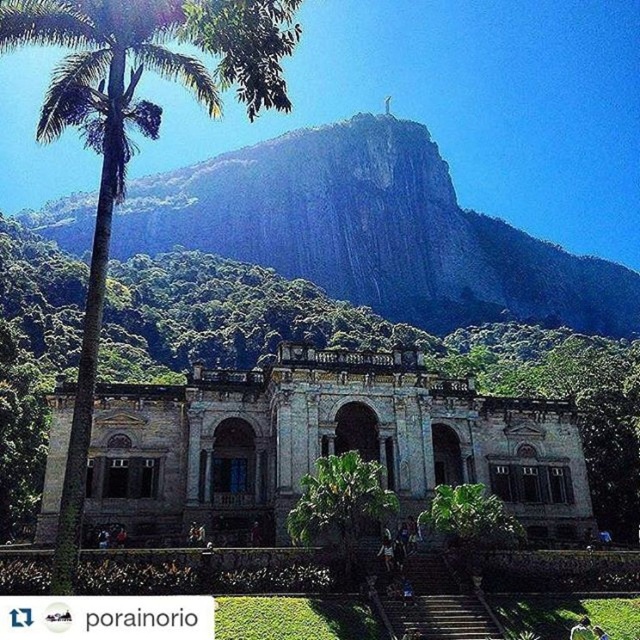
Who is taller, weathered stone palace at center or black fabric person at center?

weathered stone palace at center

Does weathered stone palace at center have a lesser width compared to black fabric person at center?

No, weathered stone palace at center is not thinner than black fabric person at center.

Does point (456, 460) lie in front of point (573, 634)?

No, it is not.

You are a GUI agent. You are given a task and a screenshot of the screen. Output one action in this format:
    pyautogui.click(x=<x>, y=<y>)
    Task: Click on the weathered stone palace at center
    The image size is (640, 640).
    Given the screenshot: What is the action you would take?
    pyautogui.click(x=323, y=444)

Consider the image. Does green leafy palm tree at left have a greater height compared to green leafy tree at center?

Correct, green leafy palm tree at left is much taller as green leafy tree at center.

Which is more to the right, green leafy palm tree at left or green leafy tree at center?

green leafy tree at center

What do you see at coordinates (138, 129) in the screenshot? Image resolution: width=640 pixels, height=640 pixels. I see `green leafy palm tree at left` at bounding box center [138, 129].

The height and width of the screenshot is (640, 640). I want to click on green leafy palm tree at left, so click(x=138, y=129).

Is the position of rugged stone mountain at upper center more distant than that of black fabric person at center?

Yes, rugged stone mountain at upper center is further from the viewer.

Does rugged stone mountain at upper center appear over black fabric person at center?

Indeed, rugged stone mountain at upper center is positioned over black fabric person at center.

Is point (433, 300) farther from viewer compared to point (588, 636)?

Yes, point (433, 300) is behind point (588, 636).

Locate an element on the screen. Image resolution: width=640 pixels, height=640 pixels. rugged stone mountain at upper center is located at coordinates (372, 230).